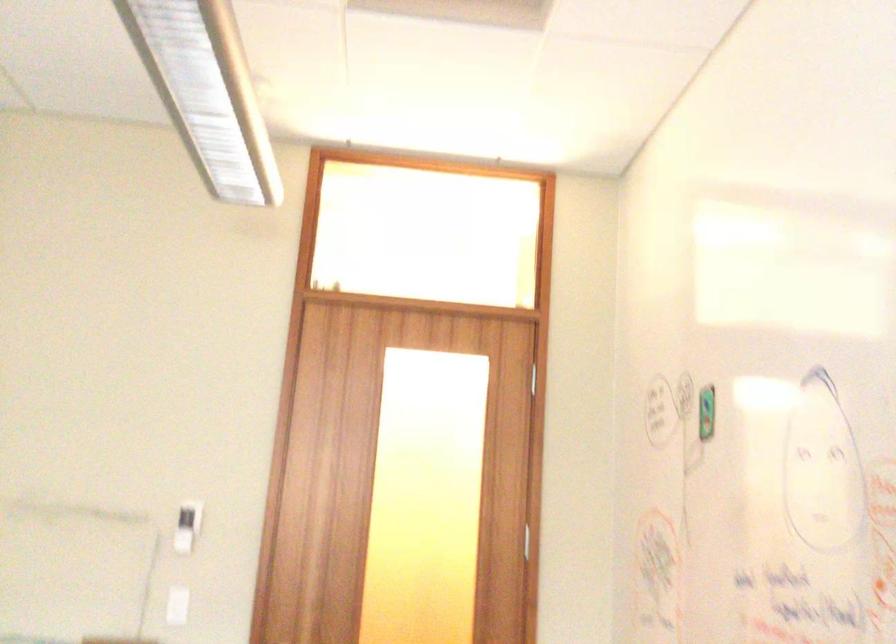
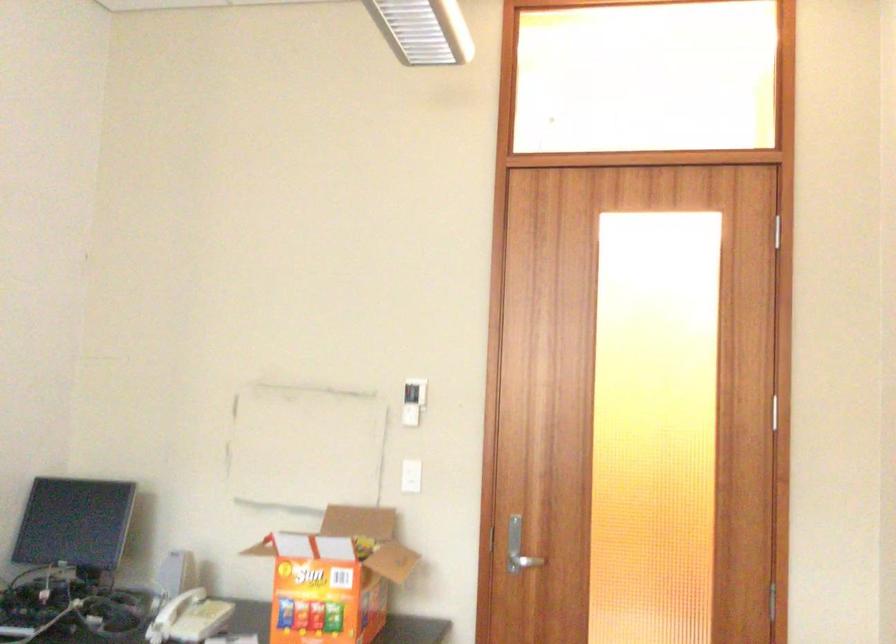
In the second image, find the point that corresponds to pixel 186 523 in the first image.

(412, 401)